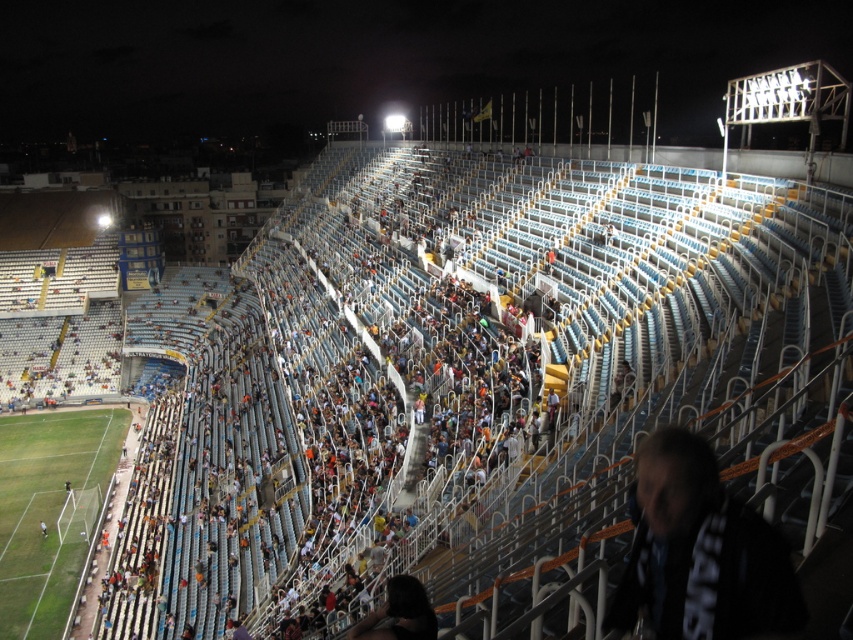
Question: Which object appears farthest from the camera in this image?

Choices:
 (A) green grass football field at lower left
 (B) dark hair at lower center

Answer: (A)

Question: Is dark fabric jacket at lower right smaller than green grass football field at lower left?

Choices:
 (A) no
 (B) yes

Answer: (B)

Question: Which point is farther to the camera?

Choices:
 (A) dark fabric jacket at lower right
 (B) green grass football field at lower left
 (C) dark hair at lower center

Answer: (B)

Question: Which object appears closest to the camera in this image?

Choices:
 (A) dark fabric jacket at lower right
 (B) dark hair at lower center

Answer: (A)

Question: Can you confirm if green grass football field at lower left is thinner than dark hair at lower center?

Choices:
 (A) no
 (B) yes

Answer: (A)

Question: Can you confirm if green grass football field at lower left is positioned above dark hair at lower center?

Choices:
 (A) yes
 (B) no

Answer: (B)